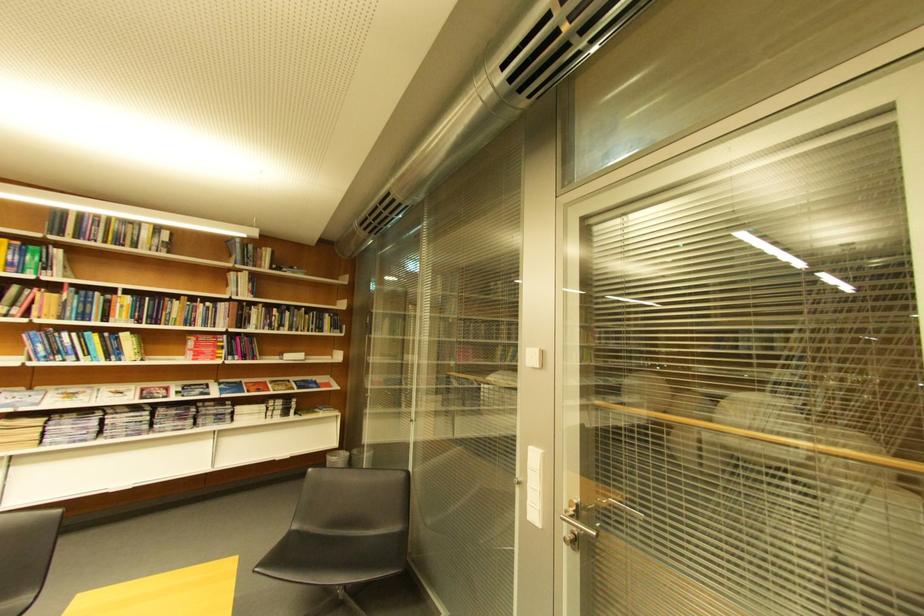
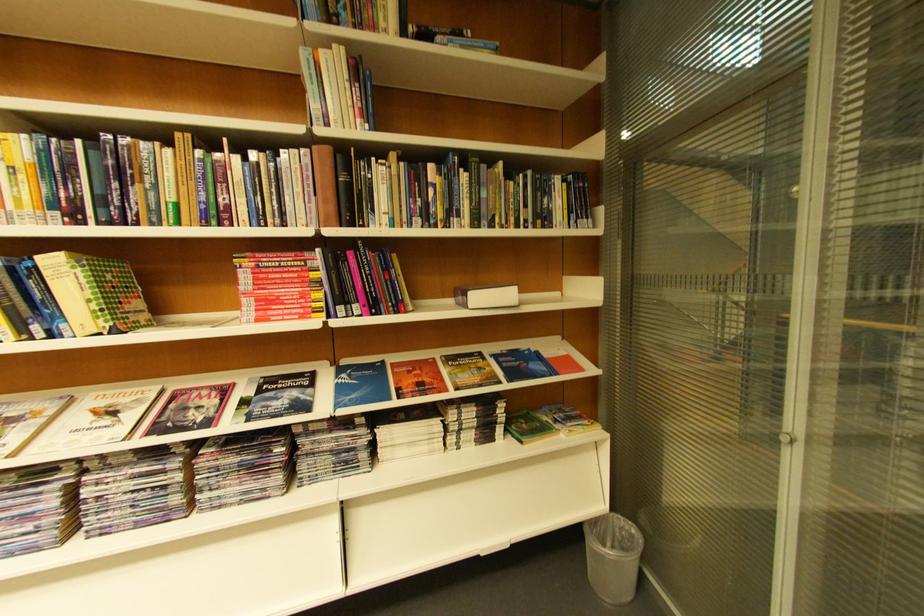
In the second image, find the point that corresponds to the point at 136,337 in the first image.

(63, 264)